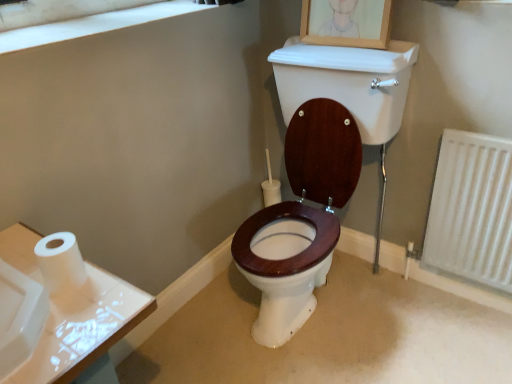
Question: Is white textured radiator at lower right smaller than wooden picture frame at upper center?

Choices:
 (A) yes
 (B) no

Answer: (B)

Question: Is white textured radiator at lower right bigger than wooden picture frame at upper center?

Choices:
 (A) yes
 (B) no

Answer: (A)

Question: Is white textured radiator at lower right further to the viewer compared to wooden picture frame at upper center?

Choices:
 (A) no
 (B) yes

Answer: (A)

Question: Considering the relative sizes of white textured radiator at lower right and wooden picture frame at upper center in the image provided, is white textured radiator at lower right wider than wooden picture frame at upper center?

Choices:
 (A) no
 (B) yes

Answer: (A)

Question: From a real-world perspective, is white textured radiator at lower right located higher than wooden picture frame at upper center?

Choices:
 (A) yes
 (B) no

Answer: (B)

Question: Does white textured radiator at lower right have a lesser height compared to wooden picture frame at upper center?

Choices:
 (A) yes
 (B) no

Answer: (B)

Question: Considering the relative positions of white matte toilet paper at left and white textured radiator at lower right in the image provided, is white matte toilet paper at left to the right of white textured radiator at lower right from the viewer's perspective?

Choices:
 (A) yes
 (B) no

Answer: (B)

Question: Considering the relative sizes of white matte toilet paper at left and white textured radiator at lower right in the image provided, is white matte toilet paper at left thinner than white textured radiator at lower right?

Choices:
 (A) no
 (B) yes

Answer: (A)

Question: Is white matte toilet paper at left to the left of white textured radiator at lower right from the viewer's perspective?

Choices:
 (A) yes
 (B) no

Answer: (A)

Question: Would you consider white matte toilet paper at left to be distant from white textured radiator at lower right?

Choices:
 (A) yes
 (B) no

Answer: (A)

Question: From the image's perspective, is white matte toilet paper at left on top of white textured radiator at lower right?

Choices:
 (A) yes
 (B) no

Answer: (B)

Question: Is white matte toilet paper at left completely or partially outside of white textured radiator at lower right?

Choices:
 (A) no
 (B) yes

Answer: (B)

Question: Is white textured radiator at lower right taller than white matte window frame at upper left?

Choices:
 (A) yes
 (B) no

Answer: (A)